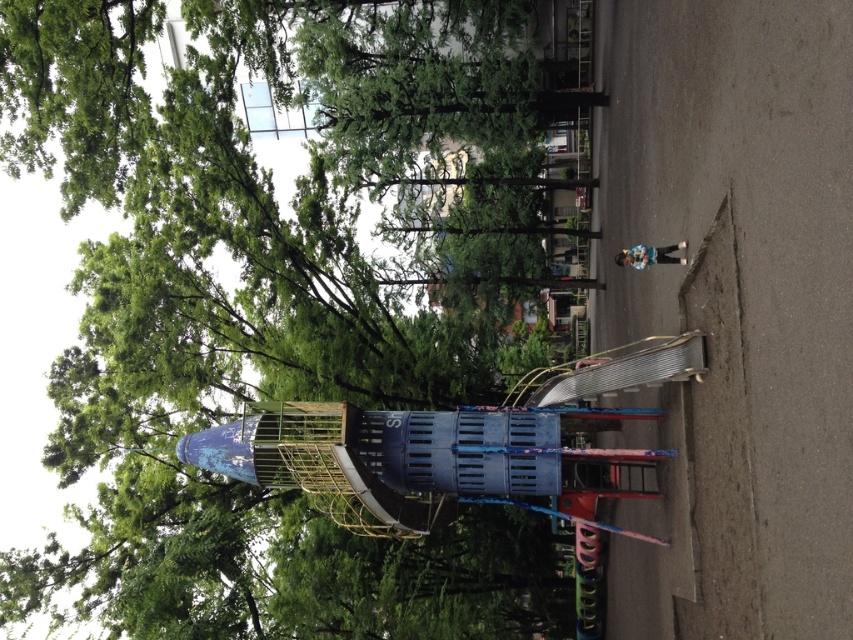
Question: Which point is closer to the camera?

Choices:
 (A) (146, 161)
 (B) (793, 298)

Answer: (B)

Question: Which point is closer to the camera taking this photo?

Choices:
 (A) (67, 49)
 (B) (822, 460)

Answer: (B)

Question: Does green matte tree at upper left come in front of metallic playground slide at center?

Choices:
 (A) no
 (B) yes

Answer: (A)

Question: Can you confirm if green matte tree at upper left is positioned to the right of metallic playground slide at center?

Choices:
 (A) no
 (B) yes

Answer: (A)

Question: Does green matte tree at upper left appear on the right side of metallic playground slide at center?

Choices:
 (A) yes
 (B) no

Answer: (B)